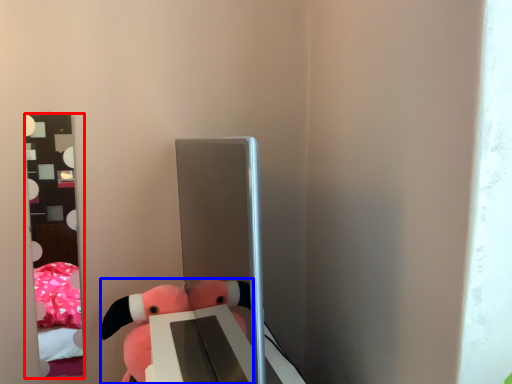
Question: Which object is closer to the camera taking this photo, mirror (highlighted by a red box) or toy (highlighted by a blue box)?

Choices:
 (A) mirror
 (B) toy

Answer: (B)